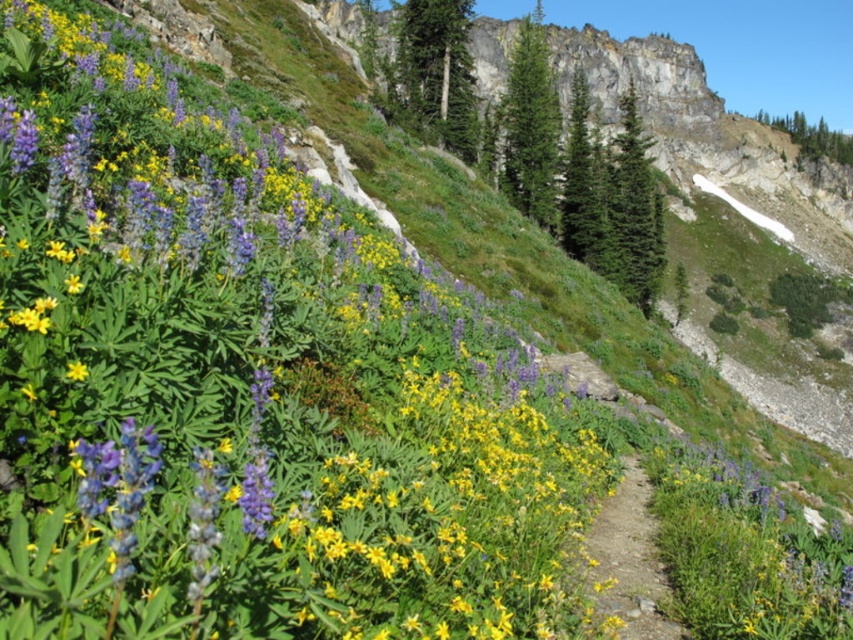
Who is lower down, purple matte flower at upper left or dirt path at center?

dirt path at center

Is purple matte flower at upper left positioned at the back of dirt path at center?

No, purple matte flower at upper left is closer to the viewer.

The height and width of the screenshot is (640, 853). In order to click on purple matte flower at upper left in this screenshot , I will do `click(248, 390)`.